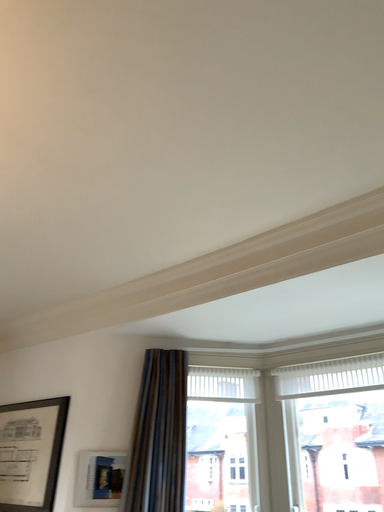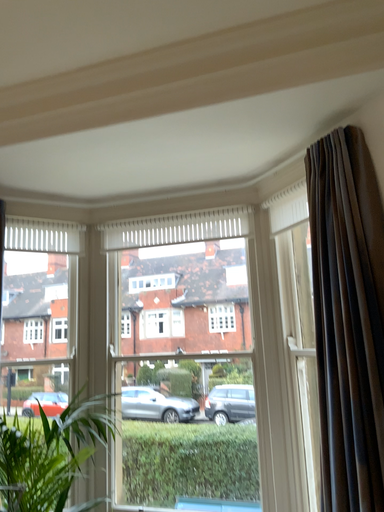
Question: Which way did the camera rotate in the video?

Choices:
 (A) rotated downward
 (B) rotated upward

Answer: (A)